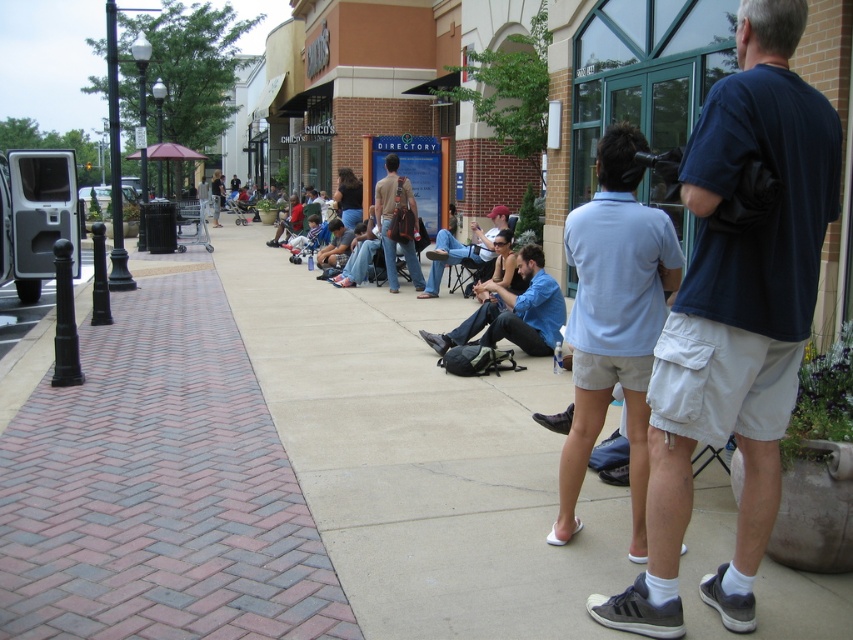
Can you confirm if dark blue t-shirt at center is positioned above denim jeans at center?

No.

Who is more forward, (761,116) or (476,259)?

Positioned in front is point (761,116).

Locate an element on the screen. dark blue t-shirt at center is located at coordinates [x=735, y=317].

Can you confirm if concrete sidewalk at center is positioned to the left of blue denim jeans at center?

Correct, you'll find concrete sidewalk at center to the left of blue denim jeans at center.

Between concrete sidewalk at center and blue denim jeans at center, which one has less height?

Standing shorter between the two is blue denim jeans at center.

Between point (279, 310) and point (518, 296), which one is positioned behind?

The point (279, 310) is more distant.

The image size is (853, 640). Find the location of `concrete sidewalk at center`. concrete sidewalk at center is located at coordinates (421, 458).

Between concrete sidewalk at center and light blue shirt at center, which one appears on the left side from the viewer's perspective?

From the viewer's perspective, concrete sidewalk at center appears more on the left side.

Is point (621, 577) positioned behind point (628, 148)?

Yes, it is.

Image resolution: width=853 pixels, height=640 pixels. Identify the location of concrete sidewalk at center. (421, 458).